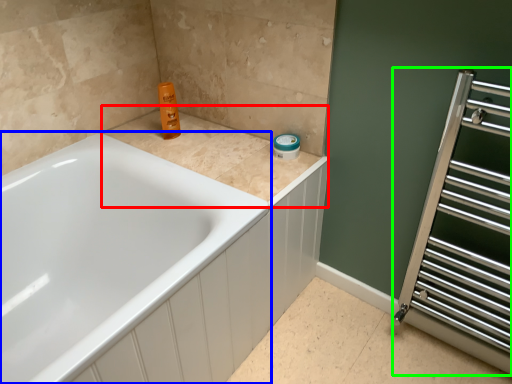
Question: Which object is the farthest from counter top (highlighted by a red box)? Choose among these: bathtub (highlighted by a blue box) or screen door (highlighted by a green box).

Choices:
 (A) bathtub
 (B) screen door

Answer: (B)